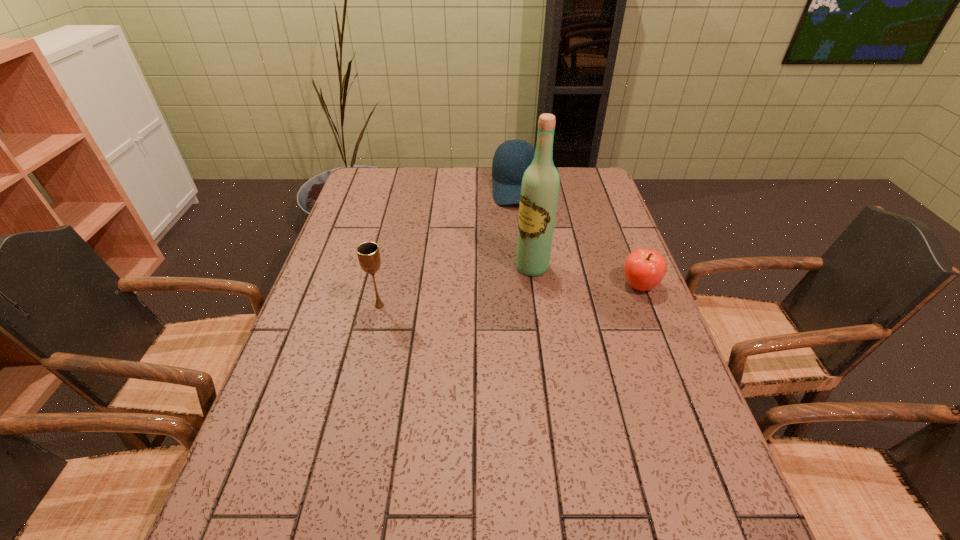
Find the location of `vacant space on the desktop that is between the third shortest object and the rightmost object and is positioned on the front-facing side of the baseball cap`. vacant space on the desktop that is between the third shortest object and the rightmost object and is positioned on the front-facing side of the baseball cap is located at coordinates (521, 295).

Locate an element on the screen. free spot on the desktop that is between the leftmost object and the rightmost object and is positioned on the front-facing side of the wine bottle is located at coordinates (476, 298).